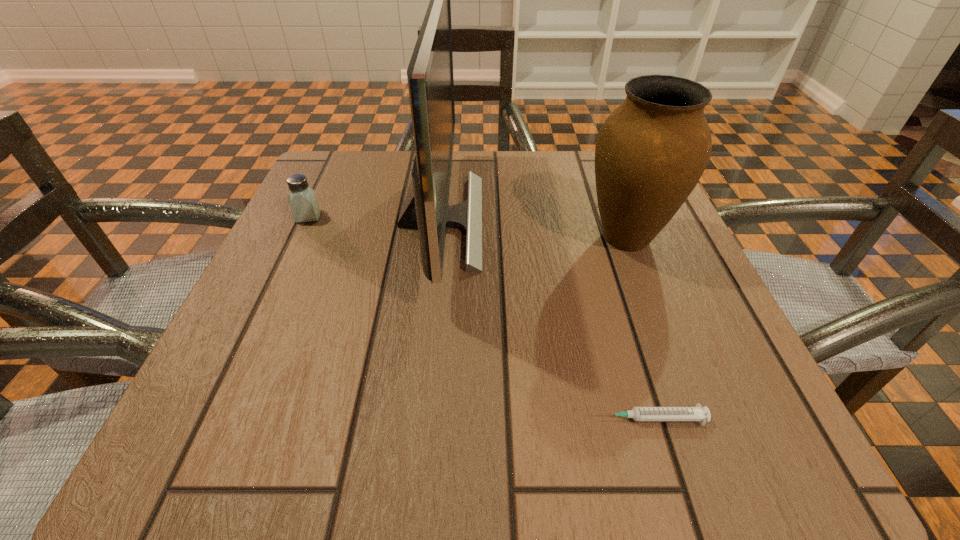
The height and width of the screenshot is (540, 960). Identify the location of object located at the far left corner. (303, 202).

Identify the location of object positioned at the far right corner. (650, 153).

At what (x,y) coordinates should I click in order to perform the action: click on object that is at the near right corner. Please return your answer as a coordinate pair (x, y). Looking at the image, I should click on (697, 413).

Locate an element on the screen. This screenshot has height=540, width=960. vacant region at the far edge of the desktop is located at coordinates (399, 163).

Locate an element on the screen. free space at the near edge is located at coordinates (390, 464).

At what (x,y) coordinates should I click in order to perform the action: click on free space at the left edge. Please return your answer as a coordinate pair (x, y). The width and height of the screenshot is (960, 540). Looking at the image, I should click on (253, 309).

This screenshot has height=540, width=960. I want to click on free space at the right edge of the desktop, so click(x=732, y=390).

In the image, there is a desktop. Identify the location of free region at the far left corner. (342, 184).

In the image, there is a desktop. Where is `blank space at the far right corner`? The height and width of the screenshot is (540, 960). blank space at the far right corner is located at coordinates (596, 210).

At what (x,y) coordinates should I click in order to perform the action: click on free area in between the leftmost object and the shortest object. Please return your answer as a coordinate pair (x, y). Looking at the image, I should click on (479, 318).